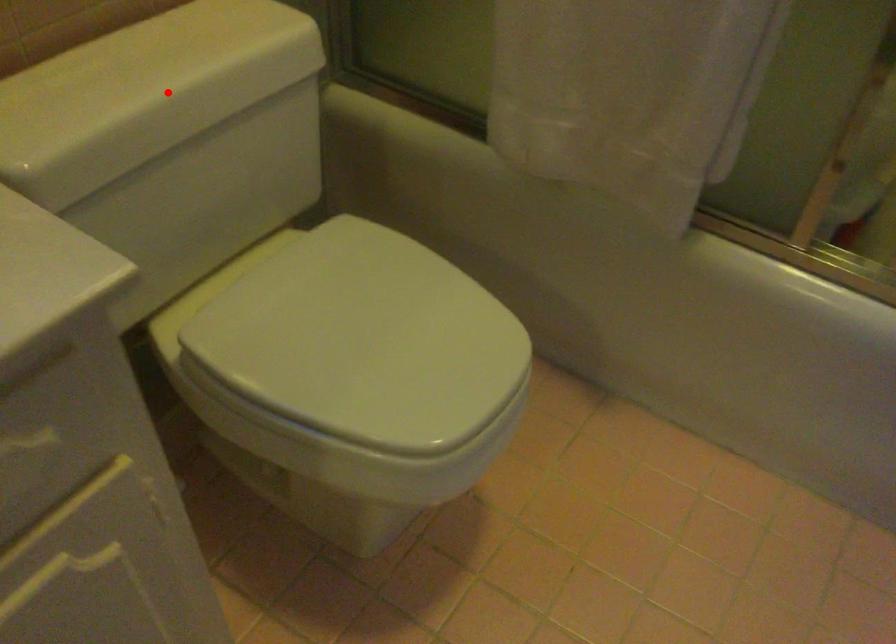
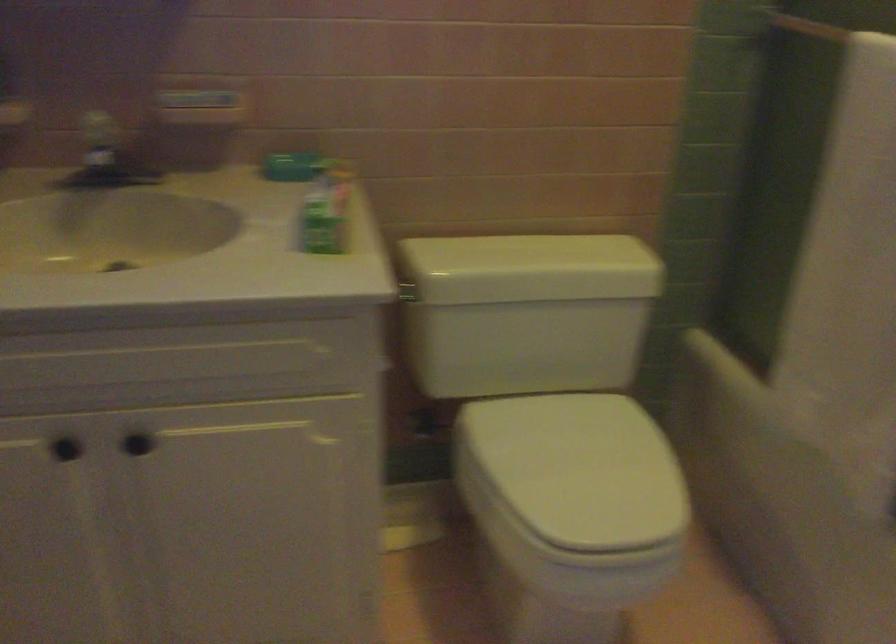
Find the pixel in the second image that matches the highlighted location in the first image.

(530, 268)